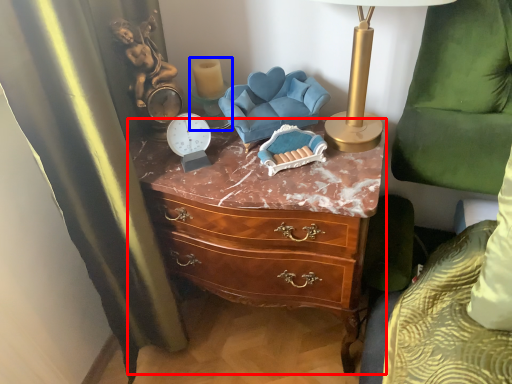
Question: Which object is further to the camera taking this photo, chest of drawers (highlighted by a red box) or candle holder (highlighted by a blue box)?

Choices:
 (A) chest of drawers
 (B) candle holder

Answer: (B)